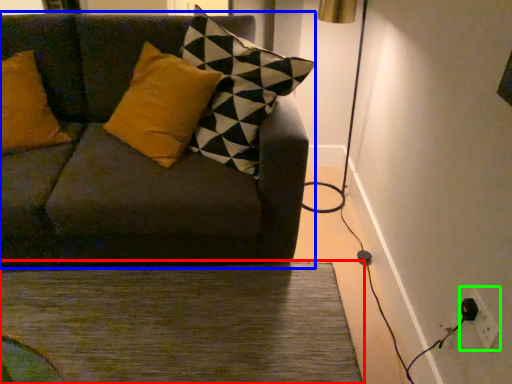
Question: Considering the real-world distances, which object is closest to doormat (highlighted by a red box)? studio couch (highlighted by a blue box) or electric outlet (highlighted by a green box).

Choices:
 (A) studio couch
 (B) electric outlet

Answer: (A)